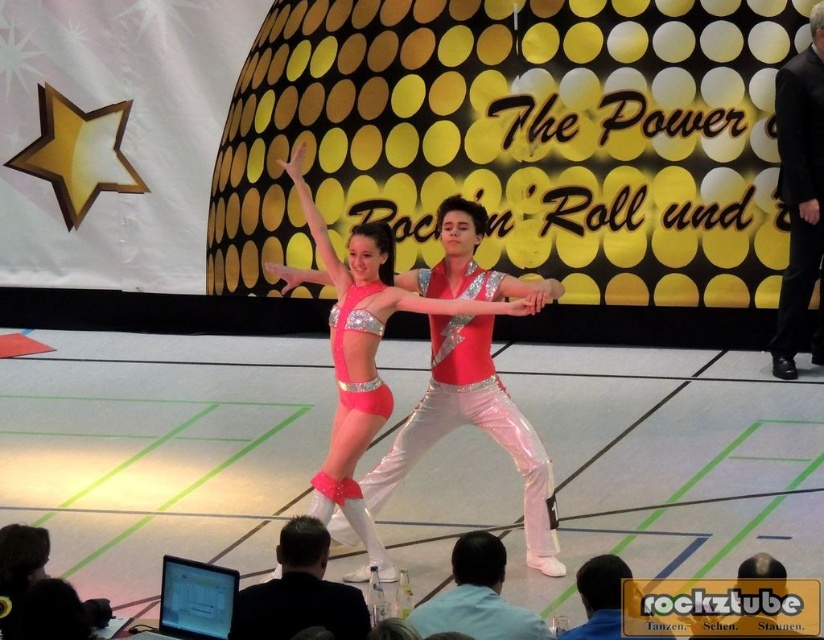
Between black velvet suit at upper right and shiny black suit at center, which one appears on the right side from the viewer's perspective?

Positioned to the right is black velvet suit at upper right.

Between point (783, 72) and point (574, 632), which one is positioned in front?

Point (574, 632) is in front.

Is point (820, 198) positioned behind point (616, 604)?

Yes, it is.

At what (x,y) coordinates should I click in order to perform the action: click on black velvet suit at upper right. Please return your answer as a coordinate pair (x, y). This screenshot has width=824, height=640. Looking at the image, I should click on (799, 195).

Is black velvet suit at upper right thinner than black leather jacket at lower center?

No, black velvet suit at upper right is not thinner than black leather jacket at lower center.

Is point (808, 282) farther from viewer compared to point (345, 627)?

That is True.

I want to click on black velvet suit at upper right, so click(x=799, y=195).

Does black leather jacket at lower center appear on the right side of shiny black suit at center?

Incorrect, black leather jacket at lower center is not on the right side of shiny black suit at center.

Who is positioned more to the left, black leather jacket at lower center or shiny black suit at center?

Positioned to the left is black leather jacket at lower center.

Find the location of a particular element. Image resolution: width=824 pixels, height=640 pixels. black leather jacket at lower center is located at coordinates click(298, 592).